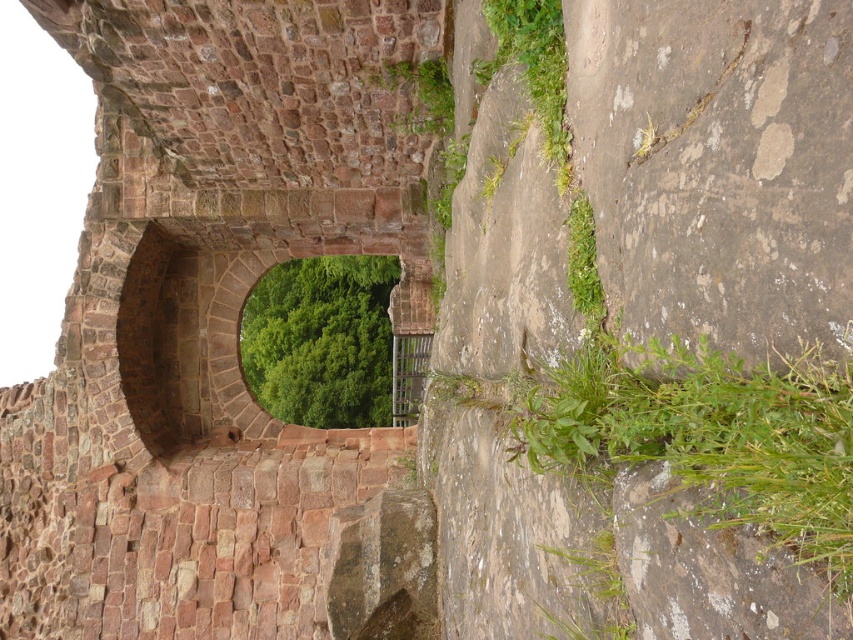
Question: Which point is closer to the camera?

Choices:
 (A) green leafy plant at upper right
 (B) green leafy vegetation at center

Answer: (A)

Question: Which object is farther from the camera taking this photo?

Choices:
 (A) green leafy plant at upper right
 (B) green leafy plant at lower right
 (C) green leafy vegetation at center

Answer: (C)

Question: Can you confirm if green leafy plant at lower right is positioned below green leafy vegetation at center?

Choices:
 (A) yes
 (B) no

Answer: (A)

Question: Can you confirm if green leafy plant at lower right is positioned to the left of green leafy plant at upper right?

Choices:
 (A) no
 (B) yes

Answer: (A)

Question: Can you confirm if green leafy vegetation at center is thinner than green leafy plant at upper right?

Choices:
 (A) yes
 (B) no

Answer: (B)

Question: Which object is closer to the camera taking this photo?

Choices:
 (A) green leafy plant at lower right
 (B) green leafy plant at upper right
 (C) green leafy vegetation at center

Answer: (A)